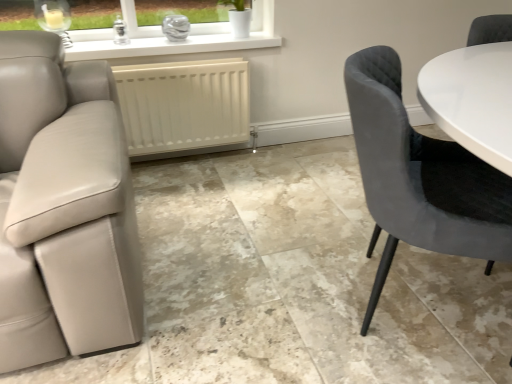
Locate an element on the screen. This screenshot has width=512, height=384. free point below white matte radiator at center (from a real-world perspective) is located at coordinates (180, 163).